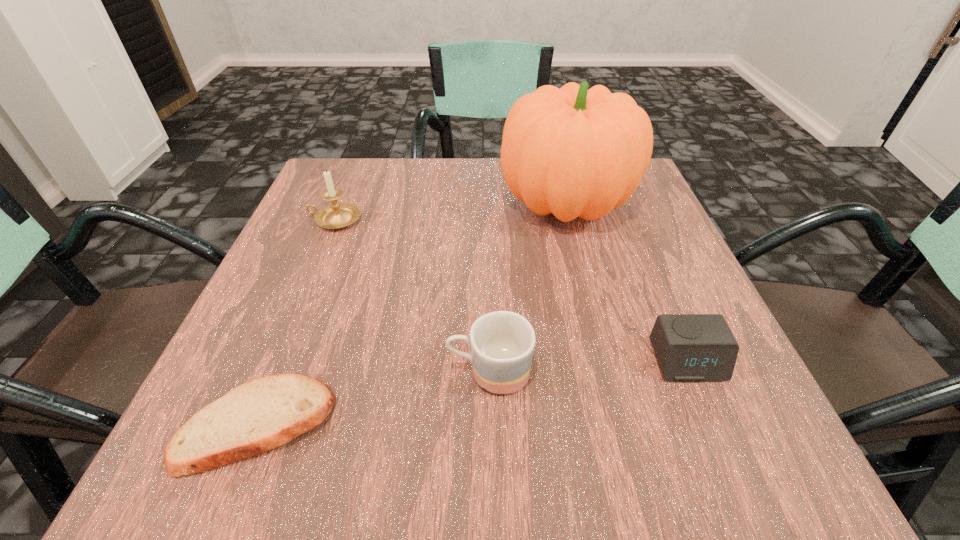
The height and width of the screenshot is (540, 960). I want to click on vacant point located 0.250m on the back of the pita bread, so click(x=321, y=265).

The image size is (960, 540). I want to click on pumpkin that is at the far edge, so click(573, 152).

Where is `candle holder that is at the far edge`? candle holder that is at the far edge is located at coordinates (336, 215).

Find the location of a particular element. The height and width of the screenshot is (540, 960). object that is at the near edge is located at coordinates (255, 417).

Identify the location of candle holder located at the left edge. (336, 215).

Identify the location of pita bread positioned at the left edge. The height and width of the screenshot is (540, 960). (255, 417).

You are a GUI agent. You are given a task and a screenshot of the screen. Output one action in this format:
    pyautogui.click(x=<x>, y=<y>)
    Task: Click on the pumpkin located in the right edge section of the desktop
    This screenshot has width=960, height=540.
    Given the screenshot: What is the action you would take?
    pyautogui.click(x=573, y=152)

In order to click on alarm clock at the right edge in this screenshot , I will do `click(689, 347)`.

This screenshot has height=540, width=960. I want to click on object present at the far left corner, so click(336, 215).

Image resolution: width=960 pixels, height=540 pixels. Identify the location of object that is at the near left corner. (255, 417).